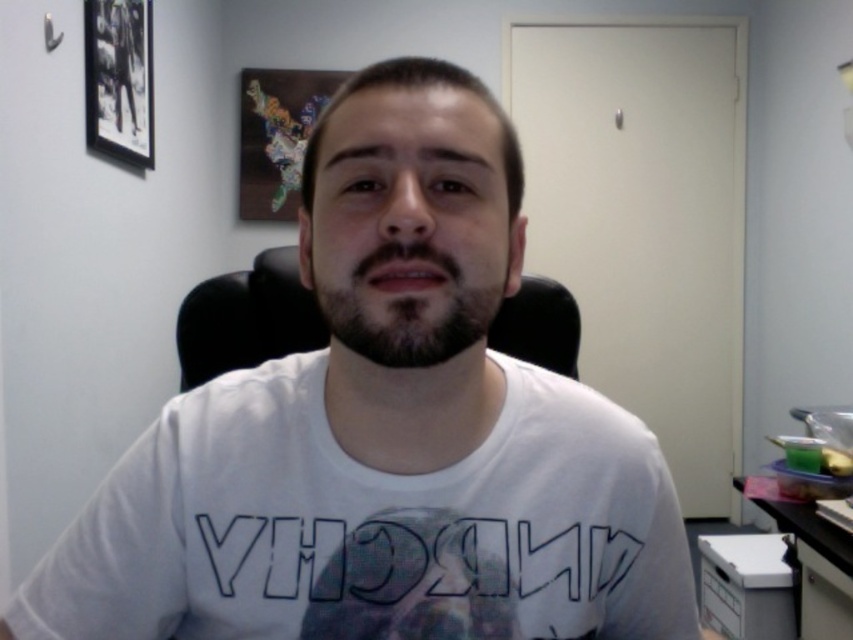
Between point (187, 337) and point (828, 580), which one is positioned in front?

Point (187, 337) is in front.

Find the location of a particular element. The image size is (853, 640). black leather chair at center is located at coordinates (247, 317).

Identify the location of black leather chair at center. The height and width of the screenshot is (640, 853). (247, 317).

Is point (306, 252) farther from camera compared to point (235, 320)?

No.

Is white cotton t-shirt at center below black leather chair at center?

Indeed, white cotton t-shirt at center is positioned under black leather chair at center.

Is point (329, 404) positioned behind point (280, 275)?

No, (329, 404) is closer to viewer.

Locate an element on the screen. This screenshot has width=853, height=640. white cotton t-shirt at center is located at coordinates (384, 433).

Does white cotton t-shirt at center have a greater height compared to dark brown fuzzy beard at center?

Yes, white cotton t-shirt at center is taller than dark brown fuzzy beard at center.

Does point (422, 374) come farther from viewer compared to point (434, 348)?

Yes, point (422, 374) is behind point (434, 348).

In order to click on white cotton t-shirt at center in this screenshot , I will do `click(384, 433)`.